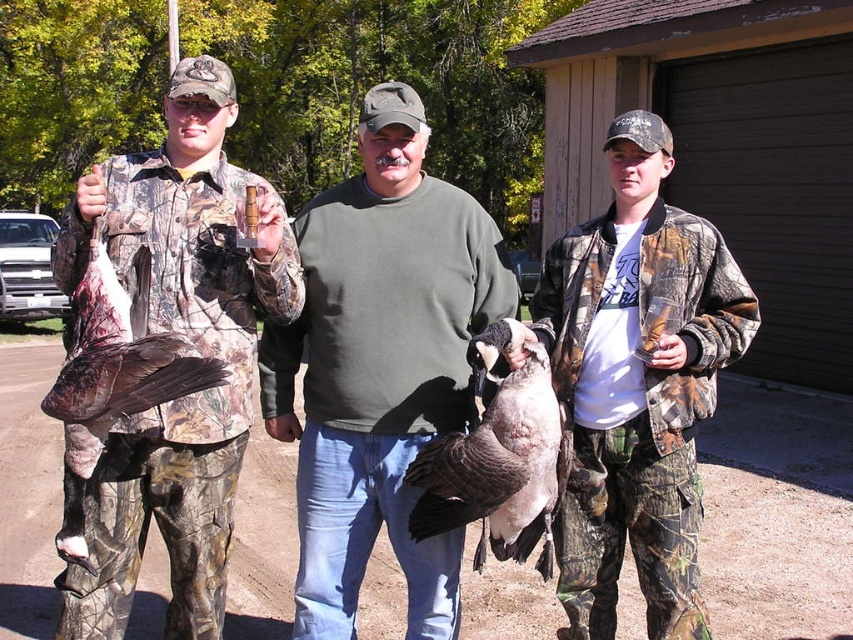
Question: Observing the image, what is the correct spatial positioning of camo jacket at center in reference to brown camo duck at left?

Choices:
 (A) below
 (B) above

Answer: (B)

Question: Estimate the real-world distances between objects in this image. Which object is farther from the dark brown feathers at center?

Choices:
 (A) camo jacket at center
 (B) green cotton sweater at center
 (C) brown camo duck at left

Answer: (C)

Question: Among these objects, which one is nearest to the camera?

Choices:
 (A) camouflage jacket at left
 (B) brown camo duck at left
 (C) green cotton sweater at center

Answer: (B)

Question: Is the position of dark brown feathers at center more distant than that of brown camo duck at left?

Choices:
 (A) no
 (B) yes

Answer: (B)

Question: Estimate the real-world distances between objects in this image. Which object is closer to the camo jacket at center?

Choices:
 (A) dark brown feathers at center
 (B) brown camo duck at left
 (C) camouflage jacket at left
 (D) green cotton sweater at center

Answer: (A)

Question: In this image, where is camouflage jacket at left located relative to brown camo duck at left?

Choices:
 (A) left
 (B) right

Answer: (B)